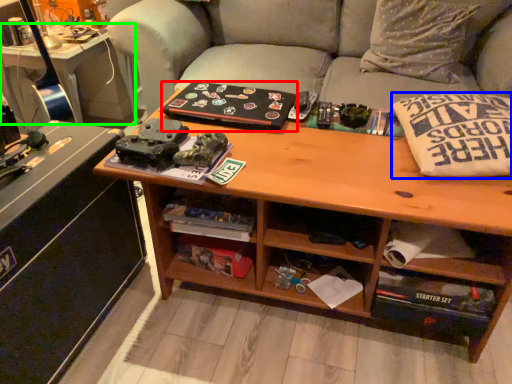
Question: Estimate the real-world distances between objects in this image. Which object is farther from book (highlighted by a red box), pillow (highlighted by a blue box) or table (highlighted by a green box)?

Choices:
 (A) pillow
 (B) table

Answer: (B)